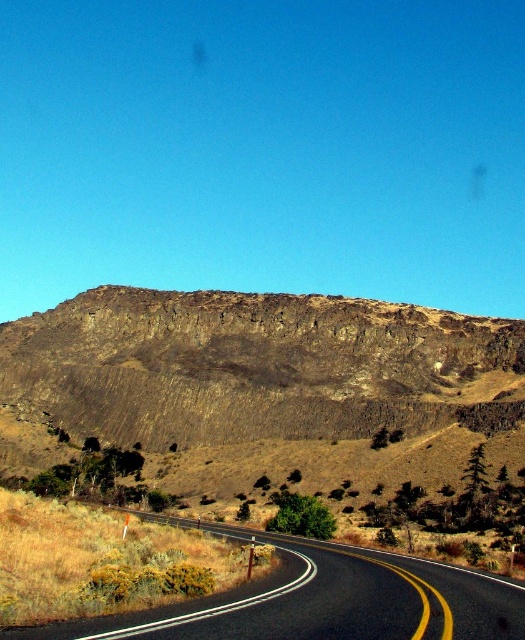
Between point (152, 410) and point (411, 627), which one is positioned behind?

Positioned behind is point (152, 410).

Is brown rocky hill at upper center positioned in front of black asphalt road at center?

No, it is not.

Which is behind, point (214, 314) or point (425, 632)?

The point (214, 314) is behind.

Where is `brown rocky hill at upper center`? brown rocky hill at upper center is located at coordinates (276, 376).